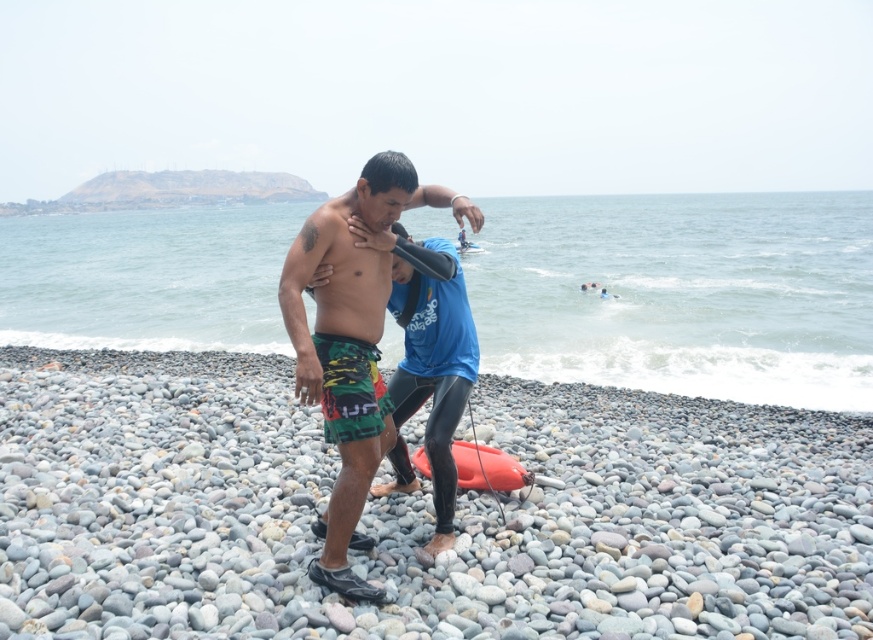
Question: Which point is closer to the camera?

Choices:
 (A) smooth pebble at center
 (B) rubber matte surfboard at center

Answer: (A)

Question: Considering the relative positions of smooth pebble at center and orange foam surfboard at center in the image provided, where is smooth pebble at center located with respect to orange foam surfboard at center?

Choices:
 (A) right
 (B) left

Answer: (B)

Question: Considering the real-world distances, which object is closest to the green patterned shorts at center?

Choices:
 (A) smooth pebble at center
 (B) blue rubber wetsuit at center

Answer: (A)

Question: Does green patterned shorts at center appear under orange foam surfboard at center?

Choices:
 (A) yes
 (B) no

Answer: (A)

Question: Does clear water at center appear on the left side of blue rubber wetsuit at center?

Choices:
 (A) no
 (B) yes

Answer: (B)

Question: Which point is closer to the camera taking this photo?

Choices:
 (A) (454, 449)
 (B) (400, 444)
 (C) (301, 317)

Answer: (C)